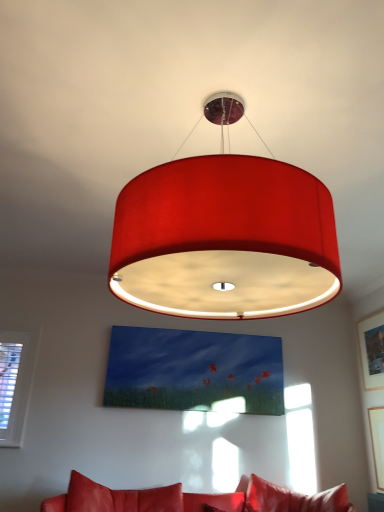
Question: Is matte fabric lampshade at center wider than leather couch at lower center?

Choices:
 (A) yes
 (B) no

Answer: (B)

Question: Does matte fabric lampshade at center have a lesser width compared to leather couch at lower center?

Choices:
 (A) yes
 (B) no

Answer: (A)

Question: Can you confirm if matte fabric lampshade at center is shorter than leather couch at lower center?

Choices:
 (A) yes
 (B) no

Answer: (B)

Question: From a real-world perspective, is matte fabric lampshade at center positioned under leather couch at lower center based on gravity?

Choices:
 (A) no
 (B) yes

Answer: (A)

Question: Is matte fabric lampshade at center facing towards leather couch at lower center?

Choices:
 (A) yes
 (B) no

Answer: (B)

Question: Relative to matte fabric lampshade at center, is leather couch at lower center in front or behind?

Choices:
 (A) front
 (B) behind

Answer: (B)

Question: Is leather couch at lower center wider or thinner than matte fabric lampshade at center?

Choices:
 (A) thin
 (B) wide

Answer: (B)

Question: Is point (160, 502) positioned closer to the camera than point (153, 279)?

Choices:
 (A) closer
 (B) farther

Answer: (B)

Question: From the image's perspective, is leather couch at lower center located above or below matte fabric lampshade at center?

Choices:
 (A) above
 (B) below

Answer: (B)

Question: From the image's perspective, is wooden picture frame at upper right, which is the second picture frame from bottom to top, positioned above or below leather couch at lower center?

Choices:
 (A) below
 (B) above

Answer: (B)

Question: Is point (362, 350) positioned closer to the camera than point (256, 501)?

Choices:
 (A) farther
 (B) closer

Answer: (A)

Question: From their relative heights in the image, would you say wooden picture frame at upper right, which is the second picture frame from bottom to top, is taller or shorter than leather couch at lower center?

Choices:
 (A) tall
 (B) short

Answer: (A)

Question: Visually, is wooden picture frame at upper right, which is the second picture frame from bottom to top, positioned to the left or to the right of leather couch at lower center?

Choices:
 (A) right
 (B) left

Answer: (A)

Question: Would you say matte fabric lampshade at center is to the left or to the right of matte white picture frame at upper right, which is the 1th picture frame in bottom-to-top order, in the picture?

Choices:
 (A) left
 (B) right

Answer: (A)

Question: Considering the positions of matte fabric lampshade at center and matte white picture frame at upper right, which is the 2th picture frame in top-to-bottom order, in the image, is matte fabric lampshade at center taller or shorter than matte white picture frame at upper right, which is the 2th picture frame in top-to-bottom order,?

Choices:
 (A) tall
 (B) short

Answer: (A)